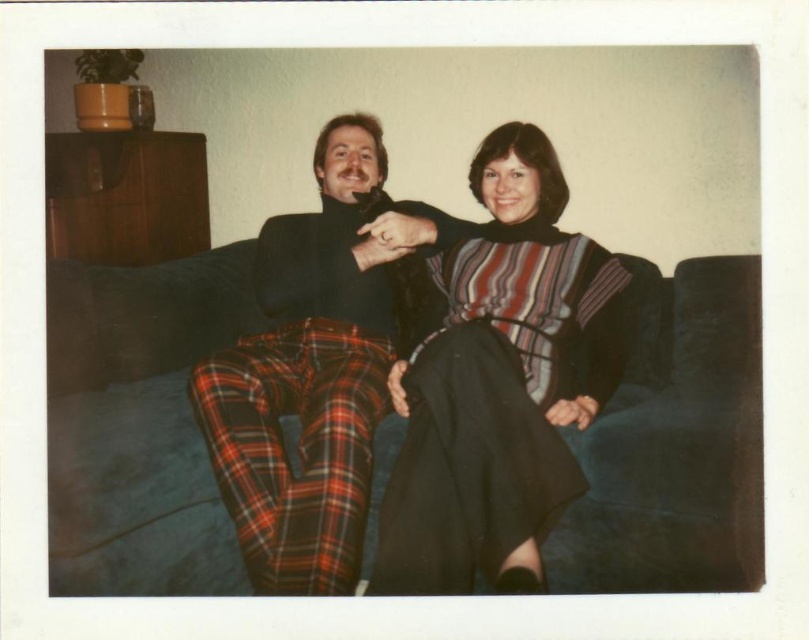
Can you confirm if striped knit sweater at center is positioned to the right of plaid wool pants at center?

Correct, you'll find striped knit sweater at center to the right of plaid wool pants at center.

In the scene shown: Who is shorter, striped knit sweater at center or plaid wool pants at center?

striped knit sweater at center is shorter.

Describe the element at coordinates (498, 381) in the screenshot. I see `striped knit sweater at center` at that location.

Locate an element on the screen. striped knit sweater at center is located at coordinates (x=498, y=381).

Which is behind, point (150, 266) or point (503, 131)?

The point (150, 266) is behind.

Is velvet blue couch at center smaller than striped knit sweater at center?

Actually, velvet blue couch at center might be larger than striped knit sweater at center.

Does point (761, 486) come farther from viewer compared to point (460, 339)?

No, (761, 486) is in front of (460, 339).

Locate an element on the screen. velvet blue couch at center is located at coordinates (138, 424).

Which of these two, velvet blue couch at center or plaid wool pants at center, stands shorter?

velvet blue couch at center

Is velvet blue couch at center closer to camera compared to plaid wool pants at center?

No, it is not.

Is point (121, 317) positioned behind point (215, 355)?

Yes, it is behind point (215, 355).

You are a GUI agent. You are given a task and a screenshot of the screen. Output one action in this format:
    pyautogui.click(x=<x>, y=<y>)
    Task: Click on the velvet blue couch at center
    The width and height of the screenshot is (809, 640).
    Given the screenshot: What is the action you would take?
    pyautogui.click(x=138, y=424)